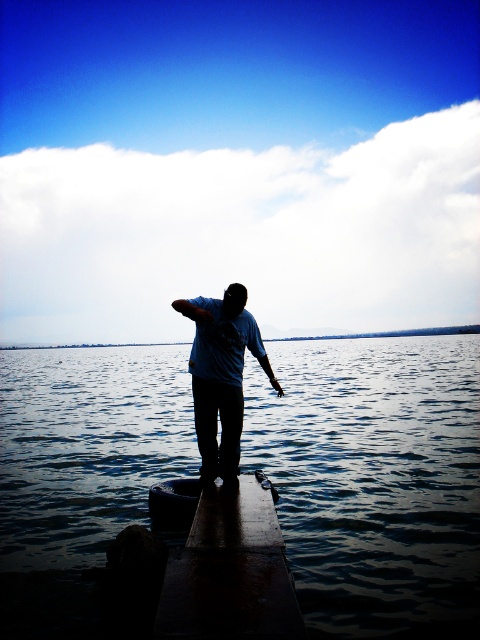
Does dark wood dock at center have a greater height compared to matte blue shirt at center?

No, dark wood dock at center is not taller than matte blue shirt at center.

Who is positioned more to the right, dark wood dock at center or matte blue shirt at center?

dark wood dock at center is more to the right.

Describe the element at coordinates (229, 572) in the screenshot. I see `dark wood dock at center` at that location.

This screenshot has height=640, width=480. What are the coordinates of `dark wood dock at center` in the screenshot? It's located at (229, 572).

Which is more to the right, dark blue water at center or matte blue shirt at center?

Positioned to the right is dark blue water at center.

Does dark blue water at center appear under matte blue shirt at center?

Yes.

Between point (324, 488) and point (231, 465), which one is positioned behind?

The point (324, 488) is behind.

The image size is (480, 640). I want to click on dark blue water at center, so click(373, 477).

Does dark blue water at center have a lesser width compared to dark wood dock at center?

No.

From the picture: Can you confirm if dark blue water at center is smaller than dark wood dock at center?

Incorrect, dark blue water at center is not smaller in size than dark wood dock at center.

Find the location of a particular element. Image resolution: width=480 pixels, height=640 pixels. dark blue water at center is located at coordinates (373, 477).